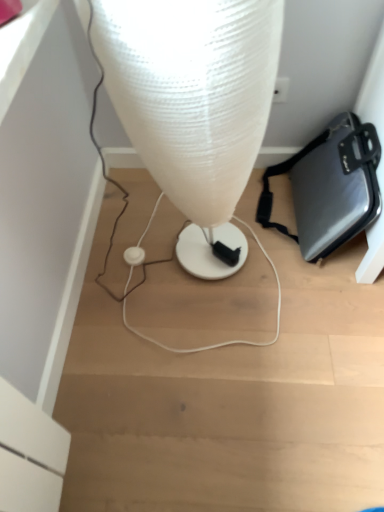
At what (x,y) coordinates should I click in order to perform the action: click on vacant space that's between translucent plastic lamp at center and white plastic earphone at center. Please return your answer as a coordinate pair (x, y). The image size is (384, 512). Looking at the image, I should click on (144, 263).